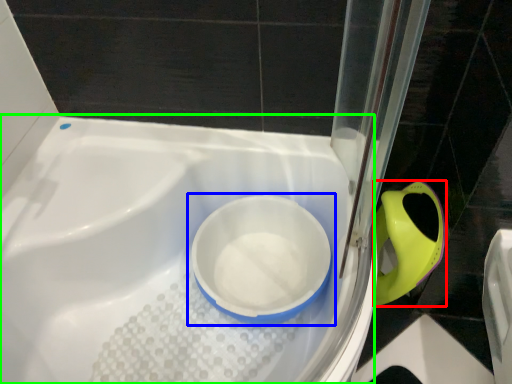
Question: Estimate the real-world distances between objects in this image. Which object is farther from bidet (highlighted by a red box), toilet (highlighted by a blue box) or bath (highlighted by a green box)?

Choices:
 (A) toilet
 (B) bath

Answer: (B)